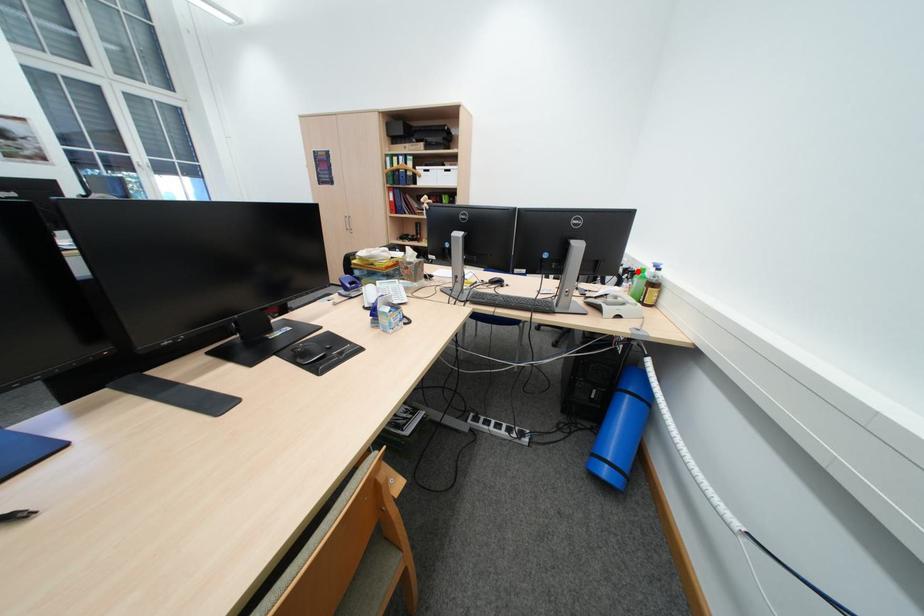
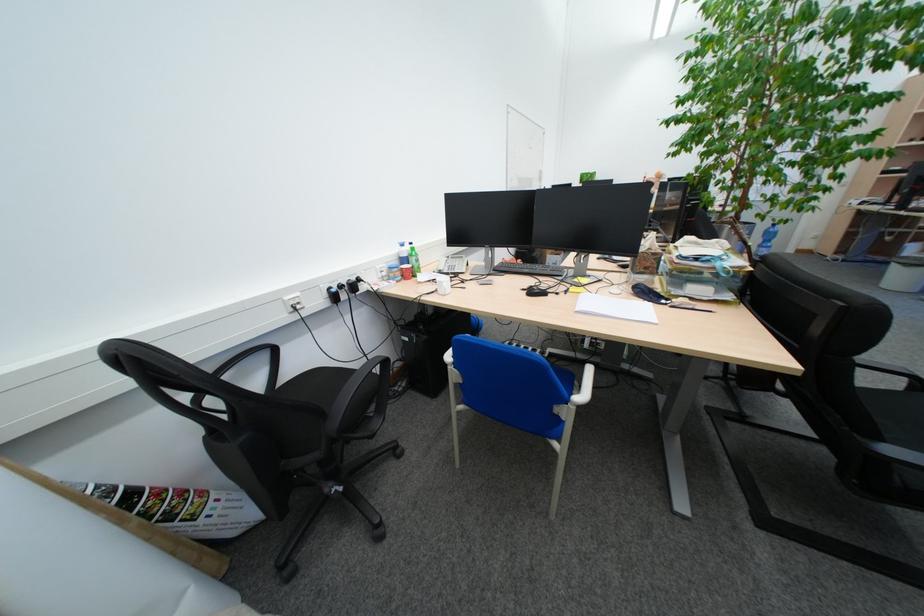
Question: I am providing you with two images of the same scene from different viewpoints. A red point is marked on the first image. Can you still see the location of the red point in image 2?

Choices:
 (A) Yes
 (B) No

Answer: (B)